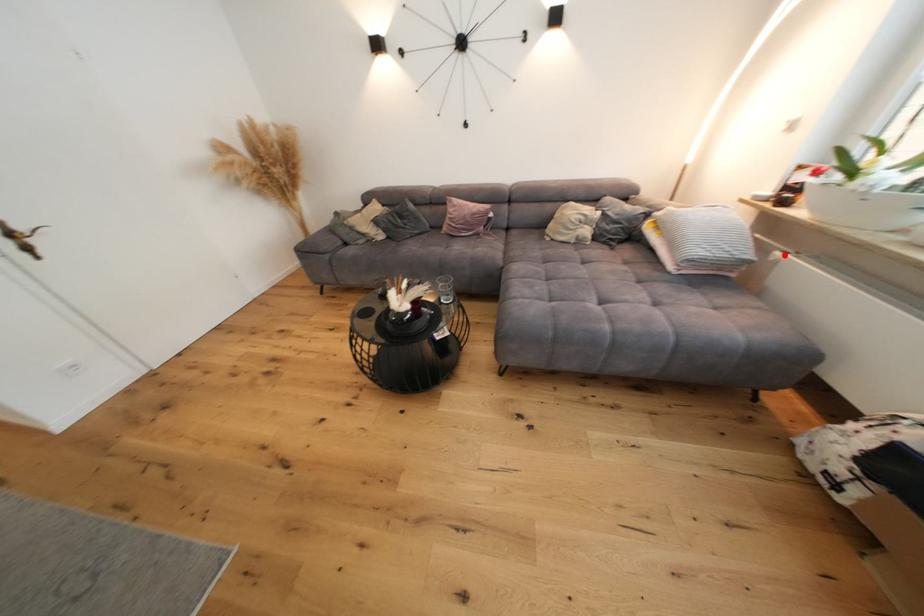
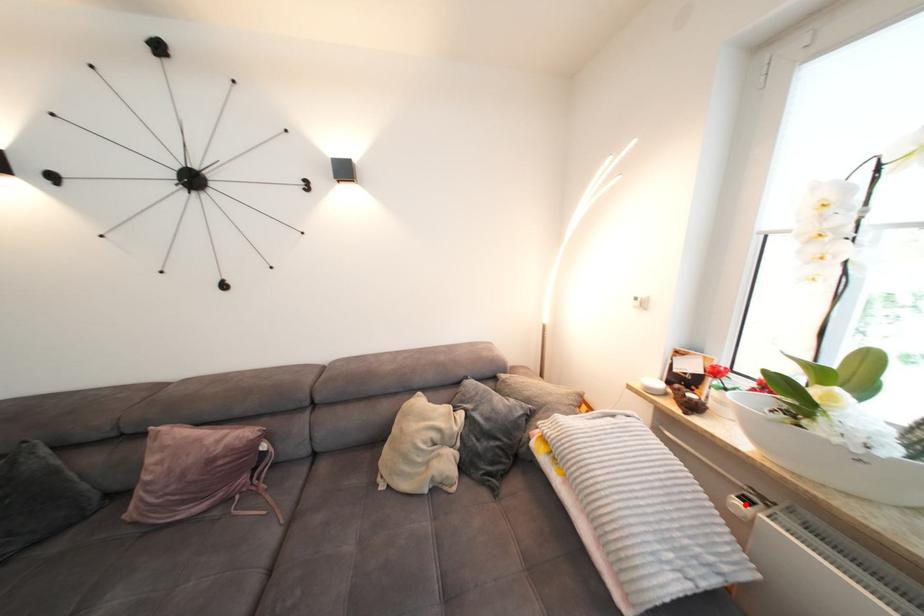
I am providing you with two images of the same scene from different viewpoints. A red point is marked on the first image and another point is marked on the second image. Do the highlighted points in image1 and image2 indicate the same real-world spot?

Yes